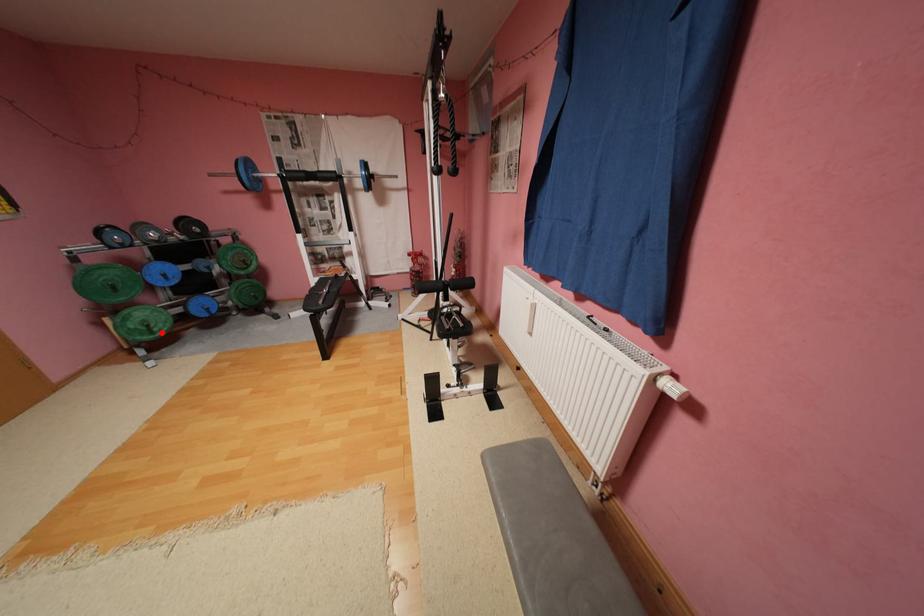
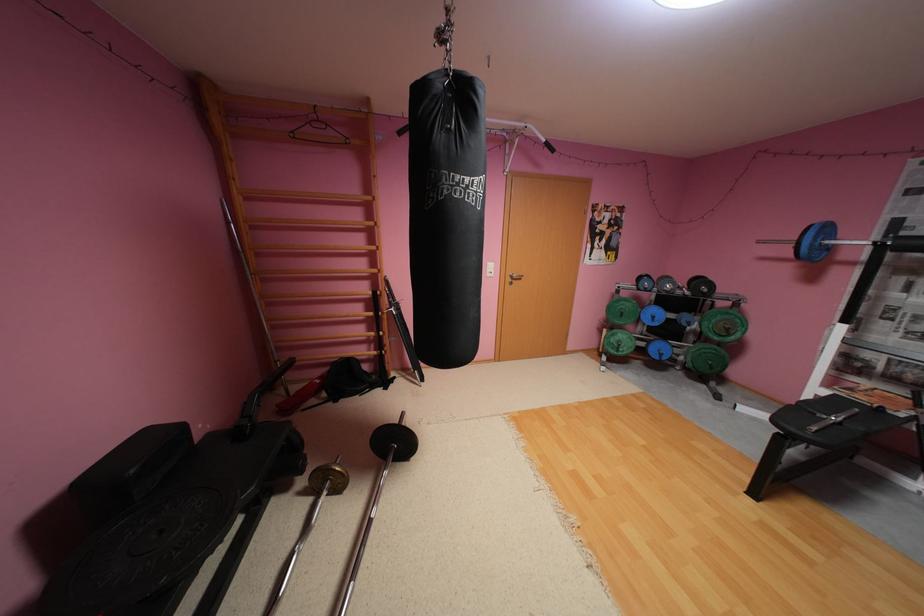
Question: I am providing you with two images of the same scene from different viewpoints. Given a red point in image1, look at the same physical point in image2. Is it:

Choices:
 (A) Closer to the viewpoint
 (B) Farther from the viewpoint

Answer: (A)